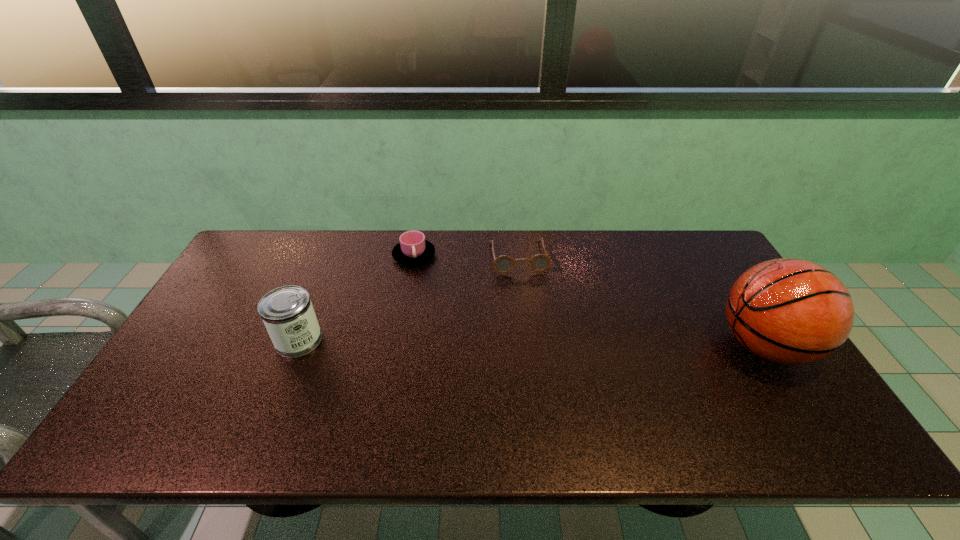
The width and height of the screenshot is (960, 540). What are the coordinates of `can` in the screenshot? It's located at (287, 312).

At what (x,y) coordinates should I click in order to perform the action: click on the third shortest object. Please return your answer as a coordinate pair (x, y). Looking at the image, I should click on (287, 312).

Where is `basketball`? basketball is located at coordinates (789, 311).

You are a GUI agent. You are given a task and a screenshot of the screen. Output one action in this format:
    pyautogui.click(x=<x>, y=<y>)
    Task: Click on the rightmost object
    This screenshot has height=540, width=960.
    Given the screenshot: What is the action you would take?
    pyautogui.click(x=789, y=311)

Locate an element on the screen. spectacles is located at coordinates (503, 264).

Image resolution: width=960 pixels, height=540 pixels. I want to click on the second object from left to right, so click(x=413, y=249).

This screenshot has width=960, height=540. What are the coordinates of `vacant position located on the right of the can` in the screenshot? It's located at (347, 340).

Where is `free space located 0.130m on the side with spill of the basketball`? free space located 0.130m on the side with spill of the basketball is located at coordinates (667, 346).

The image size is (960, 540). I want to click on vacant space located on the side with spill of the basketball, so click(x=667, y=346).

What are the coordinates of `blank space located on the side with spill of the basketball` in the screenshot? It's located at (604, 346).